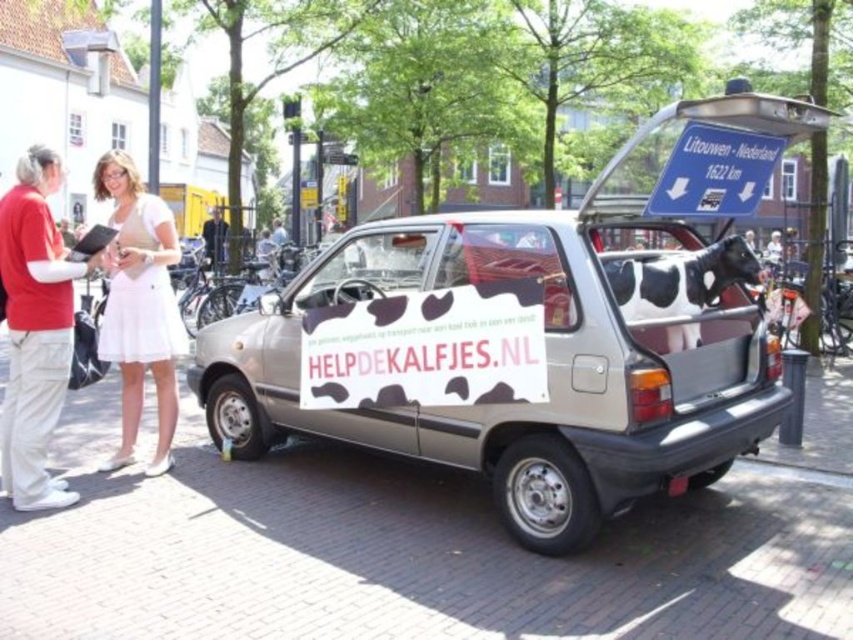
Which of these two, red cotton shirt at left or dark gray shirt at center, stands shorter?

Standing shorter between the two is red cotton shirt at left.

Is red cotton shirt at left to the right of dark gray shirt at center from the viewer's perspective?

Indeed, red cotton shirt at left is positioned on the right side of dark gray shirt at center.

Locate an element on the screen. red cotton shirt at left is located at coordinates tap(35, 330).

In the scene shown: Measure the distance between white fabric skirt at left and dark gray shirt at center.

49.73 feet

Identify the location of white fabric skirt at left. (138, 305).

Which is behind, point (122, 458) or point (206, 225)?

The point (206, 225) is behind.

Identify the location of white fabric skirt at left. The image size is (853, 640). (138, 305).

This screenshot has width=853, height=640. I want to click on red cotton shirt at left, so click(x=35, y=330).

You are a GUI agent. You are given a task and a screenshot of the screen. Output one action in this format:
    pyautogui.click(x=<x>, y=<y>)
    Task: Click on the red cotton shirt at left
    The image size is (853, 640).
    Given the screenshot: What is the action you would take?
    pyautogui.click(x=35, y=330)